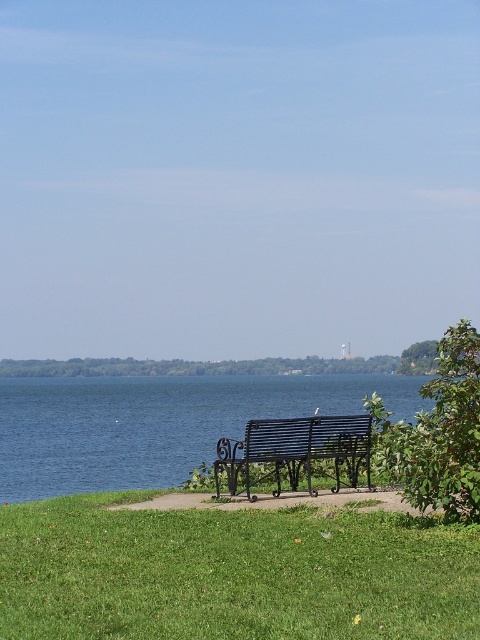
Who is shorter, green grass at lower center or blue metallic lake at center?

green grass at lower center is shorter.

Which of these two, green grass at lower center or blue metallic lake at center, stands taller?

With more height is blue metallic lake at center.

Is point (176, 625) farther from viewer compared to point (148, 452)?

No, (176, 625) is closer to viewer.

Find the location of a particular element. green grass at lower center is located at coordinates (231, 573).

Is blue metallic lake at center positioned behind black wrought iron bench at center?

No, blue metallic lake at center is in front of black wrought iron bench at center.

At what (x,y) coordinates should I click in order to perform the action: click on blue metallic lake at center. Please return your answer as a coordinate pair (x, y). The width and height of the screenshot is (480, 640). Looking at the image, I should click on (156, 422).

The image size is (480, 640). Find the location of `blue metallic lake at center`. blue metallic lake at center is located at coordinates (156, 422).

Does green grass at lower center lie behind black wrought iron bench at center?

No, it is in front of black wrought iron bench at center.

Between green grass at lower center and black wrought iron bench at center, which one has less height?

green grass at lower center

What are the coordinates of `green grass at lower center` in the screenshot? It's located at (231, 573).